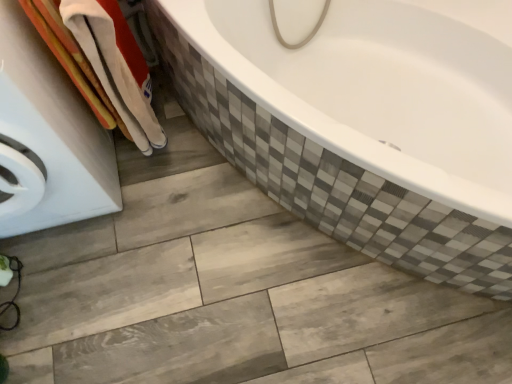
Find the location of a particular element. free area below white cotton towel at left (from a real-world perspective) is located at coordinates (160, 151).